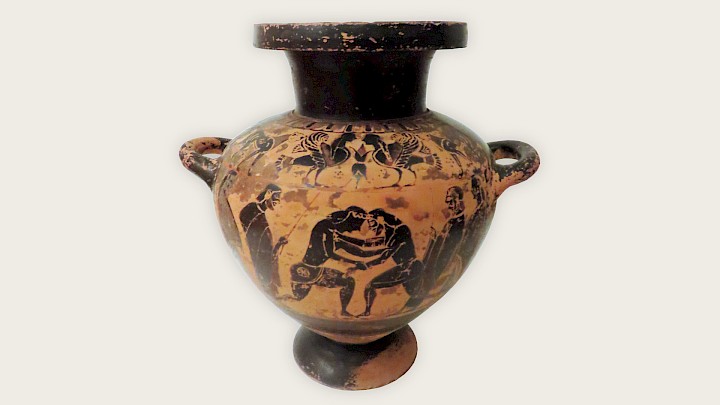
Find the location of a particular element. The height and width of the screenshot is (405, 720). vase handle is located at coordinates point(189,151), point(502,165).